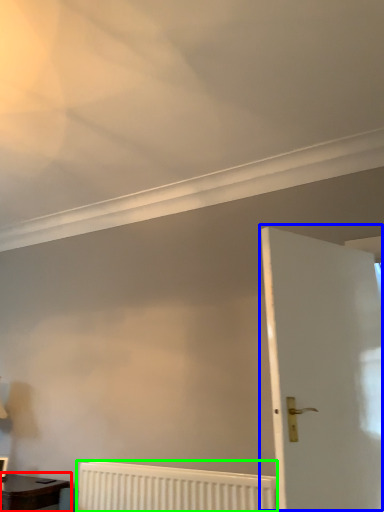
Question: Which object is positioned closest to table (highlighted by a red box)? Select from door (highlighted by a blue box) and radiator (highlighted by a green box).

Choices:
 (A) door
 (B) radiator

Answer: (B)